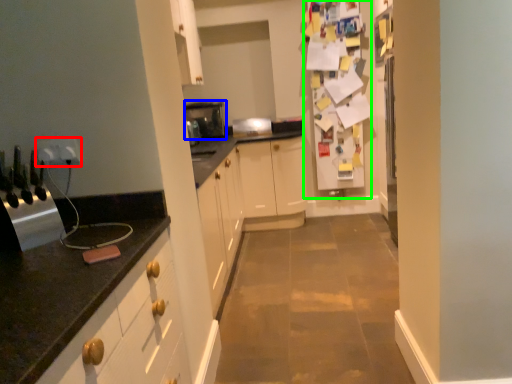
Question: Estimate the real-world distances between objects in this image. Which object is closer to electric outlet (highlighted by a red box), appliance (highlighted by a blue box) or fridge (highlighted by a green box)?

Choices:
 (A) appliance
 (B) fridge

Answer: (A)